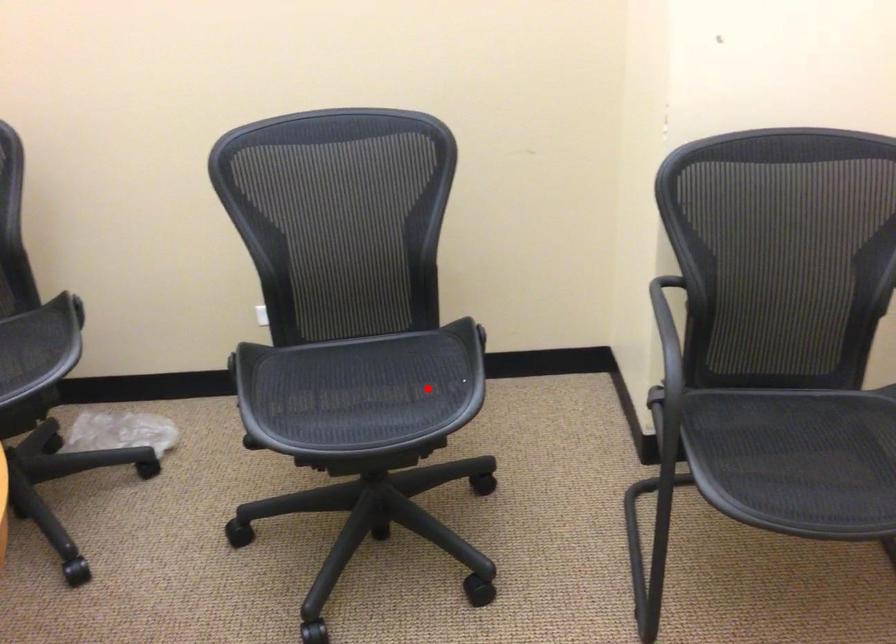
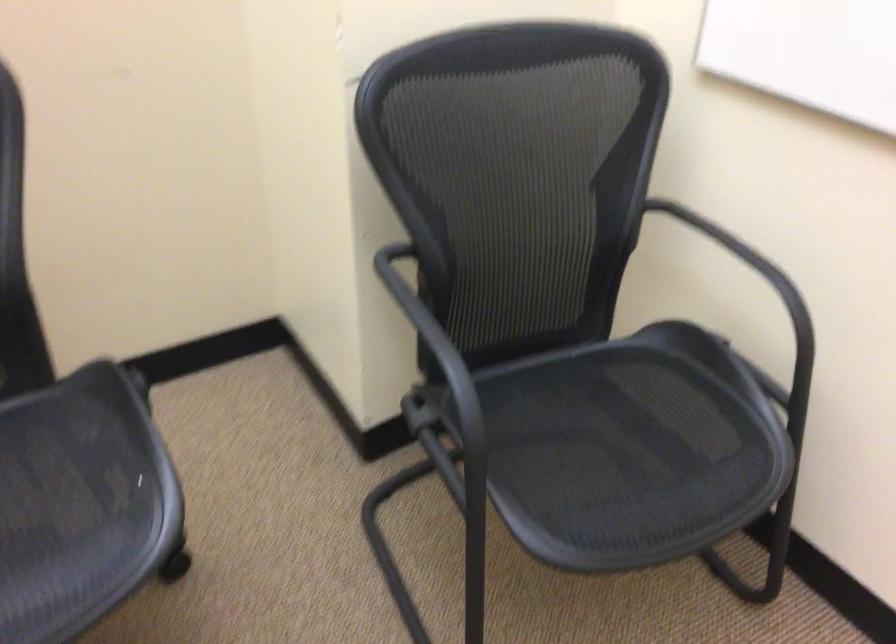
Where in the second image is the point corresponding to the highlighted location from the first image?

(80, 503)